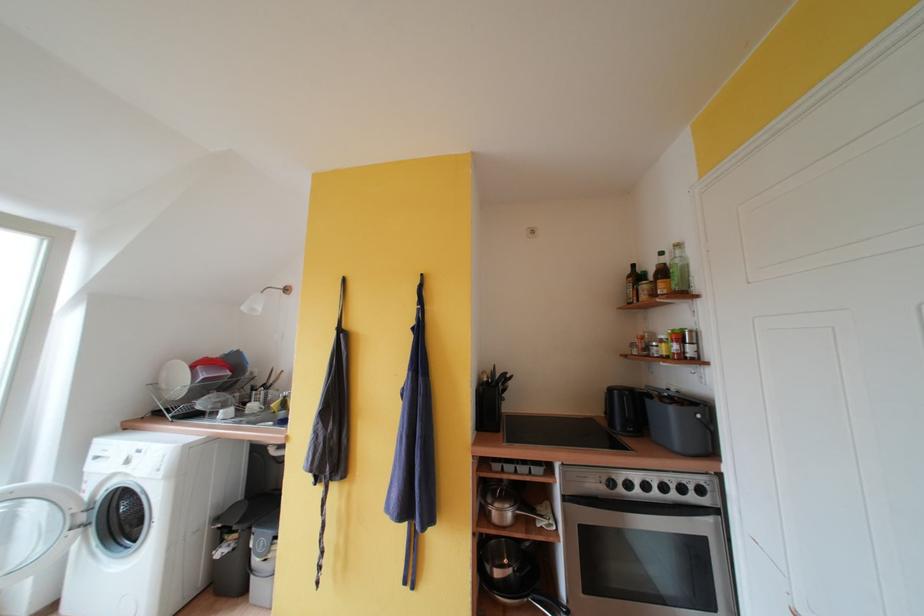
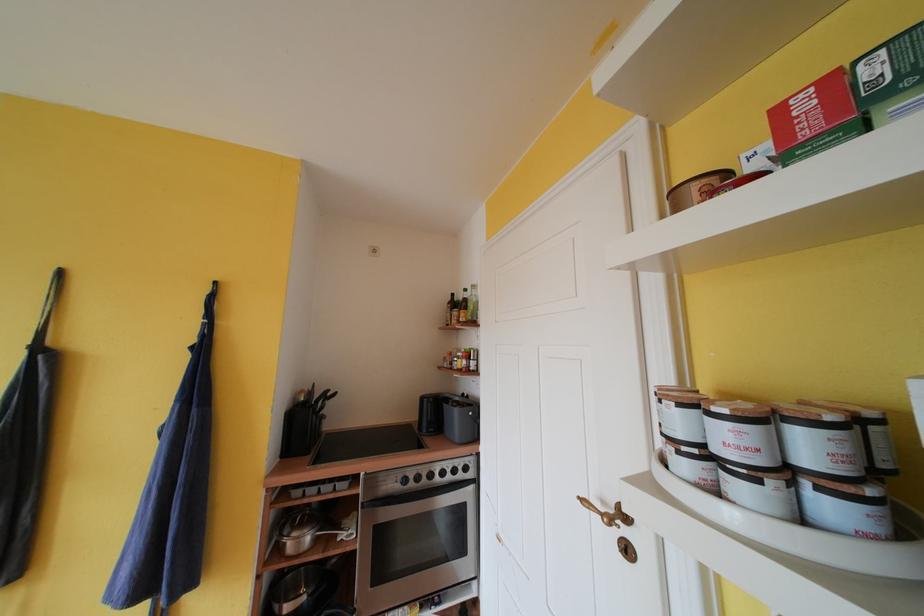
Locate, in the second image, the point that corresponds to (x=533, y=546) in the first image.

(341, 564)